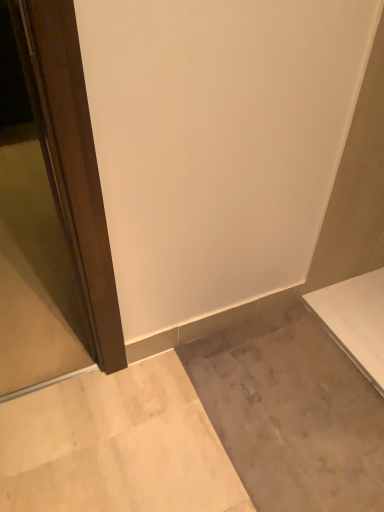
Locate an element on the screen. gray marble concrete at lower right is located at coordinates (292, 413).

What do you see at coordinates (292, 413) in the screenshot?
I see `gray marble concrete at lower right` at bounding box center [292, 413].

What is the approximate width of gray marble concrete at lower right?

gray marble concrete at lower right is 67.20 centimeters in width.

I want to click on gray marble concrete at lower right, so click(292, 413).